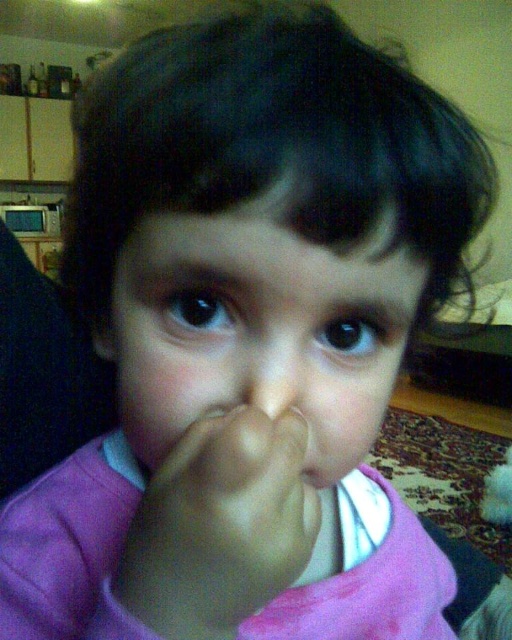
Based on the scene description, where is the smooth skin face at center located in the image?

The smooth skin face at center is located at the center of the image, at coordinates approximately point (x=260, y=330).